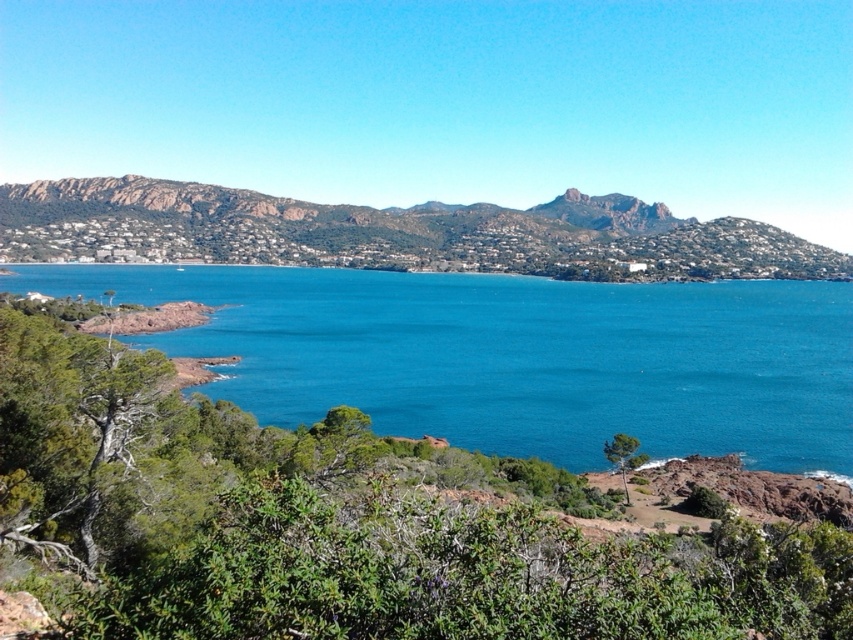
You are a photographer planning to capture the blue water at center and the rustic stone hillside at upper left in a single shot. Based on their positions in the image, which of these two elements would appear closer to the camera?

The blue water at center appears closer to the camera because it has a lesser height compared to the rustic stone hillside at upper left, indicating it is positioned in the foreground.

You are a landscape painter planning to paint the coastal scene. You have two canvases of different sizes. The first canvas is smaller and you want to focus on the area with more detail. Which object from the scene should you paint on the smaller canvas to ensure it fits well? The blue water at center or the rustic stone hillside at upper left?

The blue water at center occupies less space than the rustic stone hillside at upper left, so it would fit better on the smaller canvas.